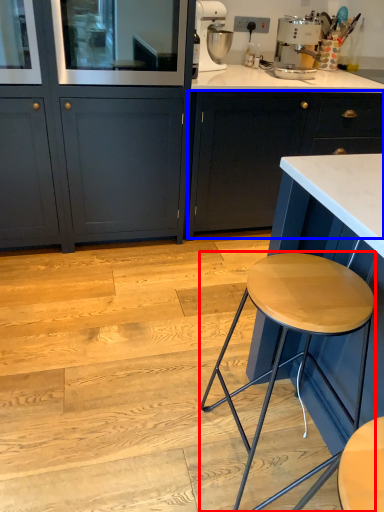
Question: Among these objects, which one is nearest to the camera, stool (highlighted by a red box) or cabinetry (highlighted by a blue box)?

Choices:
 (A) stool
 (B) cabinetry

Answer: (A)